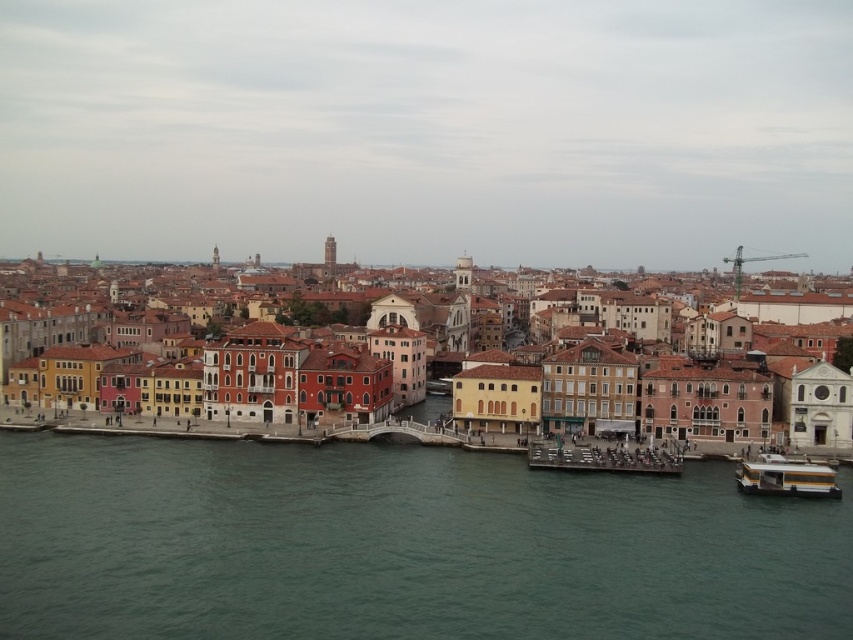
Can you confirm if greenish water at lower center is smaller than matte orange building at center?

Correct, greenish water at lower center occupies less space than matte orange building at center.

Where is `greenish water at lower center`? The width and height of the screenshot is (853, 640). greenish water at lower center is located at coordinates (399, 547).

At what (x,y) coordinates should I click in order to perform the action: click on greenish water at lower center. Please return your answer as a coordinate pair (x, y). The height and width of the screenshot is (640, 853). Looking at the image, I should click on (399, 547).

Does matte orange building at center lie behind wooden dock at center?

Yes, it is.

Is point (659, 397) positioned before point (614, 451)?

No, it is behind (614, 451).

The image size is (853, 640). I want to click on matte orange building at center, so click(x=639, y=397).

Find the location of a particular element. This screenshot has width=853, height=640. matte orange building at center is located at coordinates (639, 397).

Does greenish water at lower center appear on the right side of white glossy boat at lower right?

Incorrect, greenish water at lower center is not on the right side of white glossy boat at lower right.

Does greenish water at lower center appear under white glossy boat at lower right?

Correct, greenish water at lower center is located below white glossy boat at lower right.

Find the location of a particular element. greenish water at lower center is located at coordinates (399, 547).

Image resolution: width=853 pixels, height=640 pixels. I want to click on greenish water at lower center, so click(399, 547).